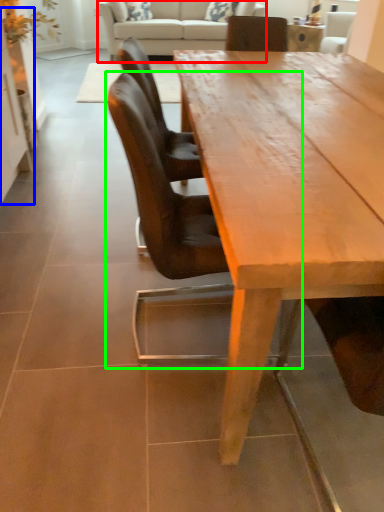
Question: Which is farther away from studio couch (highlighted by a red box)? cabinetry (highlighted by a blue box) or chair (highlighted by a green box)?

Choices:
 (A) cabinetry
 (B) chair

Answer: (B)